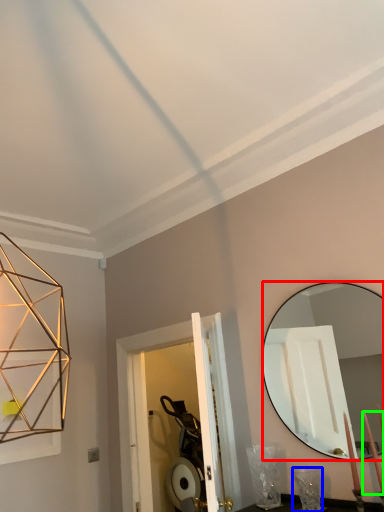
Question: Which object is positioned farthest from mirror (highlighted by a red box)? Select from table lamp (highlighted by a blue box) and candle (highlighted by a green box).

Choices:
 (A) table lamp
 (B) candle

Answer: (B)